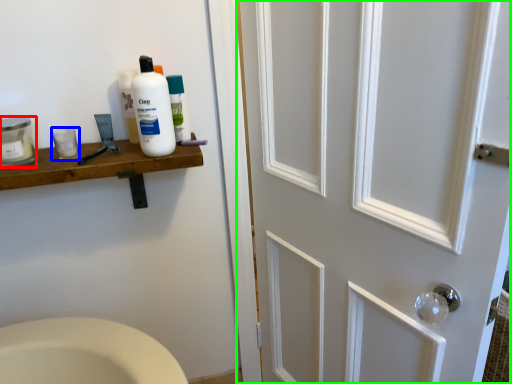
Question: Estimate the real-world distances between objects in this image. Which object is farther from mouthwash (highlighted by a red box), mouthwash (highlighted by a blue box) or door (highlighted by a green box)?

Choices:
 (A) mouthwash
 (B) door

Answer: (B)